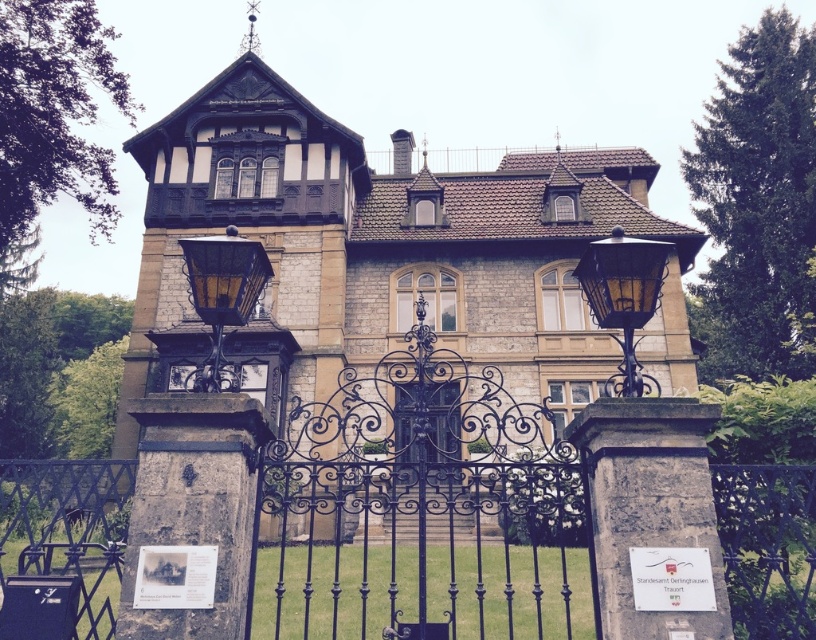
Question: Which point is closer to the camera?

Choices:
 (A) (41, 570)
 (B) (654, 248)
 (C) (251, 268)
 (D) (393, 266)

Answer: (B)

Question: Which object is the closest to the black wrought iron gate at center?

Choices:
 (A) gold wrought iron lamp at center
 (B) stone mansion at center

Answer: (A)

Question: Does stone mansion at center have a smaller size compared to gold wrought iron lamp at center?

Choices:
 (A) no
 (B) yes

Answer: (A)

Question: Does stone mansion at center appear over black wrought iron gate at center?

Choices:
 (A) no
 (B) yes

Answer: (B)

Question: In this image, where is stone mansion at center located relative to black wrought iron gate at center?

Choices:
 (A) above
 (B) below

Answer: (A)

Question: Based on their relative distances, which object is nearer to the gold wrought iron lamp at center?

Choices:
 (A) stone mansion at center
 (B) black wrought iron gate at center

Answer: (B)